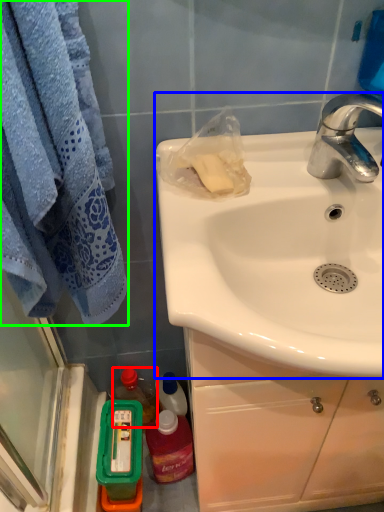
Question: Estimate the real-world distances between objects in this image. Which object is closer to bottle (highlighted by a red box), sink (highlighted by a blue box) or towel/napkin (highlighted by a green box)?

Choices:
 (A) sink
 (B) towel/napkin

Answer: (B)